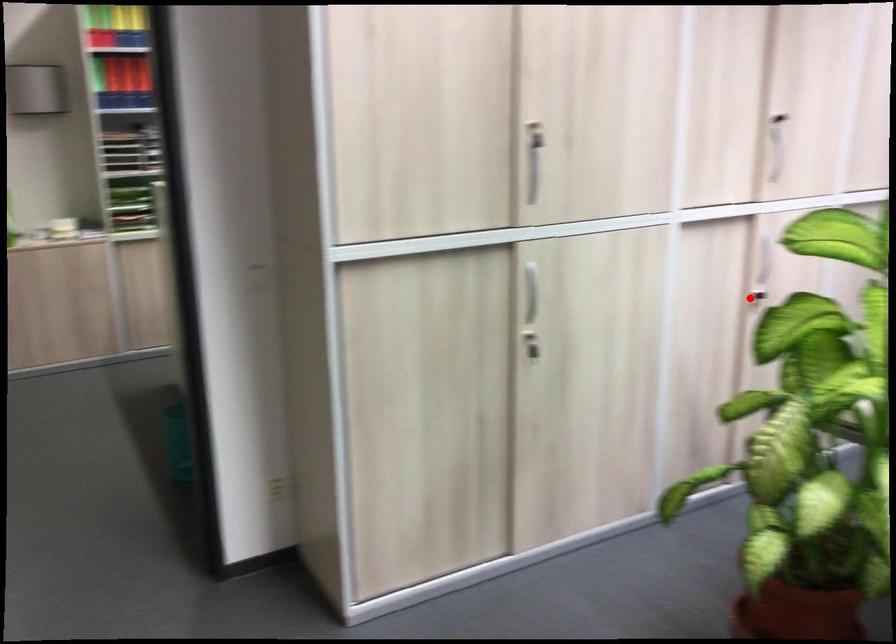
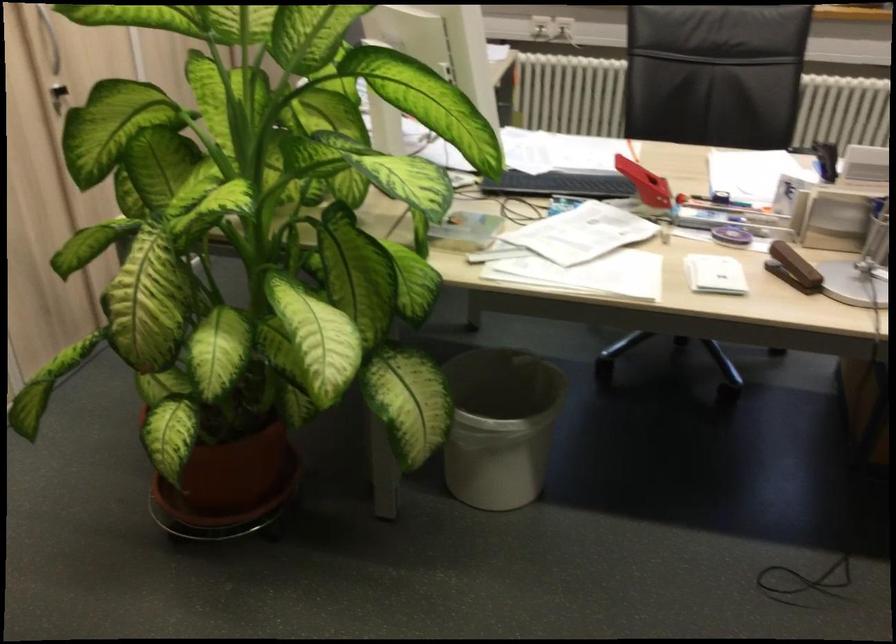
Question: I am providing you with two images of the same scene from different viewpoints. A red point is marked on the first image. Is the red point's position out of view in image 2?

Choices:
 (A) Yes
 (B) No

Answer: (B)